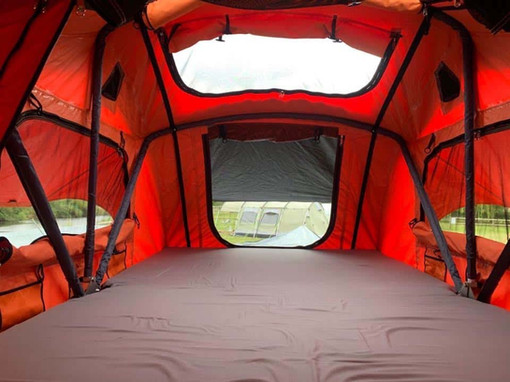
The image size is (510, 382). What are the coordinates of `folding chairs` in the screenshot? It's located at (244, 226), (267, 223).